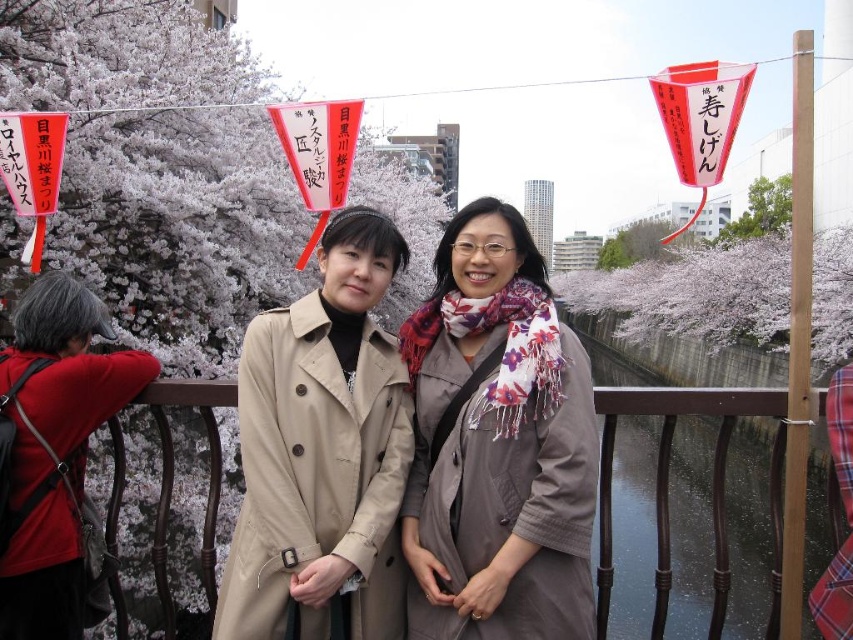
Question: Can you confirm if pink blossom tree at upper center is positioned to the left of green leafy tree at upper right?

Choices:
 (A) no
 (B) yes

Answer: (B)

Question: Estimate the real-world distances between objects in this image. Which object is farther from the pink blossom tree at upper center?

Choices:
 (A) green leafy tree at upper right
 (B) floral scarf at center
 (C) white blossoms at upper center

Answer: (B)

Question: Where is white blossoms at upper left located in relation to red fabric at left in the image?

Choices:
 (A) above
 (B) below

Answer: (A)

Question: Is beige leather trench coat at center below green leafy tree at upper right?

Choices:
 (A) no
 (B) yes

Answer: (B)

Question: Among these objects, which one is farthest from the camera?

Choices:
 (A) beige leather trench coat at center
 (B) white blossoms at upper left
 (C) white blossoms at upper center

Answer: (C)

Question: Which of the following is the closest to the observer?

Choices:
 (A) white blossoms at upper left
 (B) red fabric at left
 (C) white blossoms at upper center

Answer: (B)